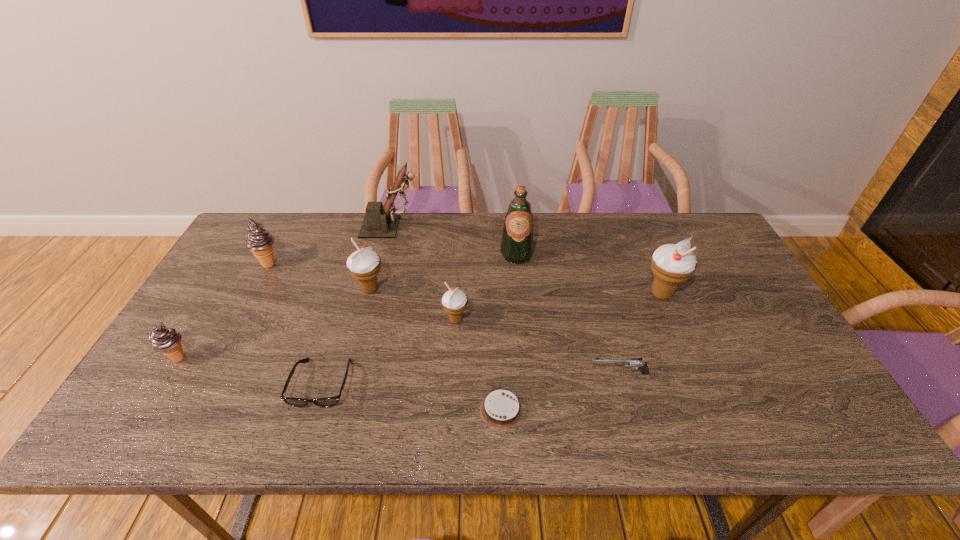
Locate an element on the screen. The image size is (960, 540). icecream at the far edge is located at coordinates 259,241.

Image resolution: width=960 pixels, height=540 pixels. In order to click on spectacles that is at the near edge in this screenshot , I will do `click(327, 401)`.

In order to click on chocolate cake at the near edge in this screenshot , I will do `click(501, 409)`.

Locate an element on the screen. This screenshot has width=960, height=540. object located in the far left corner section of the desktop is located at coordinates (259, 241).

This screenshot has height=540, width=960. I want to click on vacant region at the far edge, so click(x=438, y=243).

In the image, there is a desktop. Identify the location of free space at the near edge. (724, 436).

Locate an element on the screen. The width and height of the screenshot is (960, 540). vacant space at the left edge of the desktop is located at coordinates (220, 359).

In the image, there is a desktop. At what (x,y) coordinates should I click in order to perform the action: click on vacant space at the right edge. Please return your answer as a coordinate pair (x, y). Looking at the image, I should click on (755, 325).

Where is `free space at the near left corner of the desktop`? This screenshot has height=540, width=960. free space at the near left corner of the desktop is located at coordinates (178, 422).

The height and width of the screenshot is (540, 960). In the image, there is a desktop. Identify the location of vacant space at the far right corner. (674, 236).